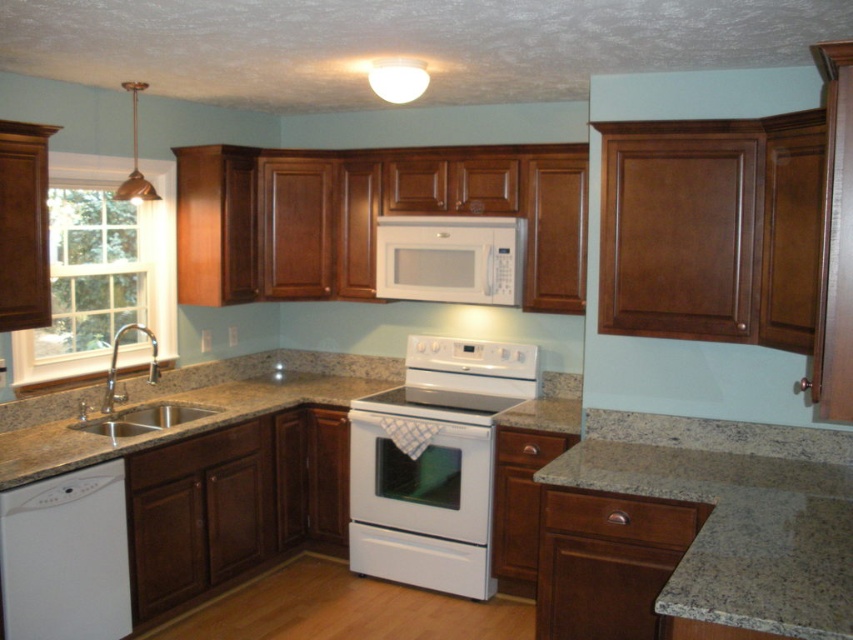
Does white glossy electric stove at center lie behind brown granite sink at lower left?

Yes, white glossy electric stove at center is behind brown granite sink at lower left.

Can you confirm if white glossy electric stove at center is bigger than brown granite sink at lower left?

Correct, white glossy electric stove at center is larger in size than brown granite sink at lower left.

Locate an element on the screen. This screenshot has height=640, width=853. white glossy electric stove at center is located at coordinates (433, 464).

Where is `white glossy electric stove at center`? This screenshot has width=853, height=640. white glossy electric stove at center is located at coordinates (433, 464).

Can you confirm if white glossy electric stove at center is positioned to the left of white glossy stove at center?

Indeed, white glossy electric stove at center is positioned on the left side of white glossy stove at center.

Where is `white glossy electric stove at center`? The width and height of the screenshot is (853, 640). white glossy electric stove at center is located at coordinates (433, 464).

Identify the location of white glossy electric stove at center. (433, 464).

How distant is white glass window at left from white glossy dishwasher at lower left?

The distance of white glass window at left from white glossy dishwasher at lower left is 3.65 feet.

Does white glass window at left appear over white glossy dishwasher at lower left?

Indeed, white glass window at left is positioned over white glossy dishwasher at lower left.

Describe the element at coordinates (97, 276) in the screenshot. I see `white glass window at left` at that location.

Find the location of `white glass window at left`. white glass window at left is located at coordinates (97, 276).